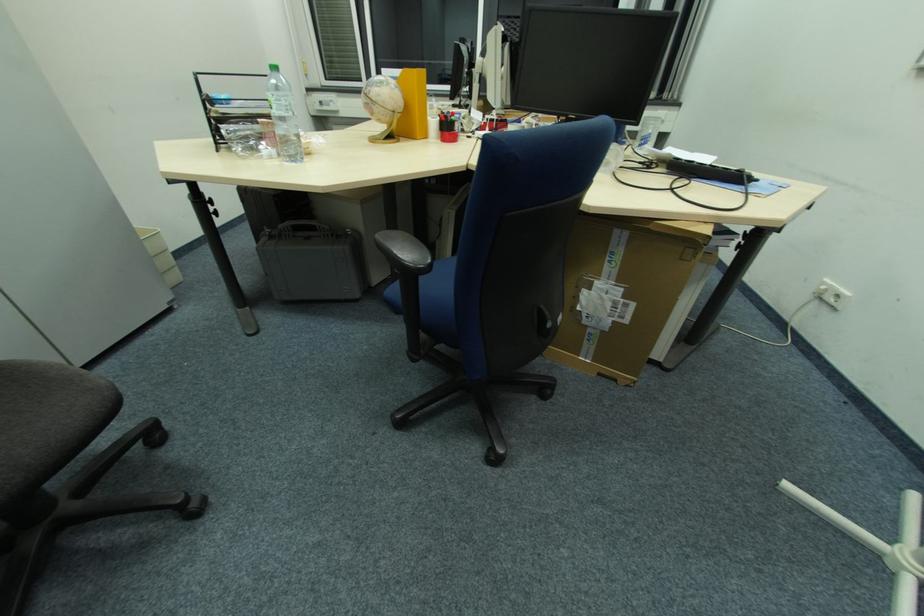
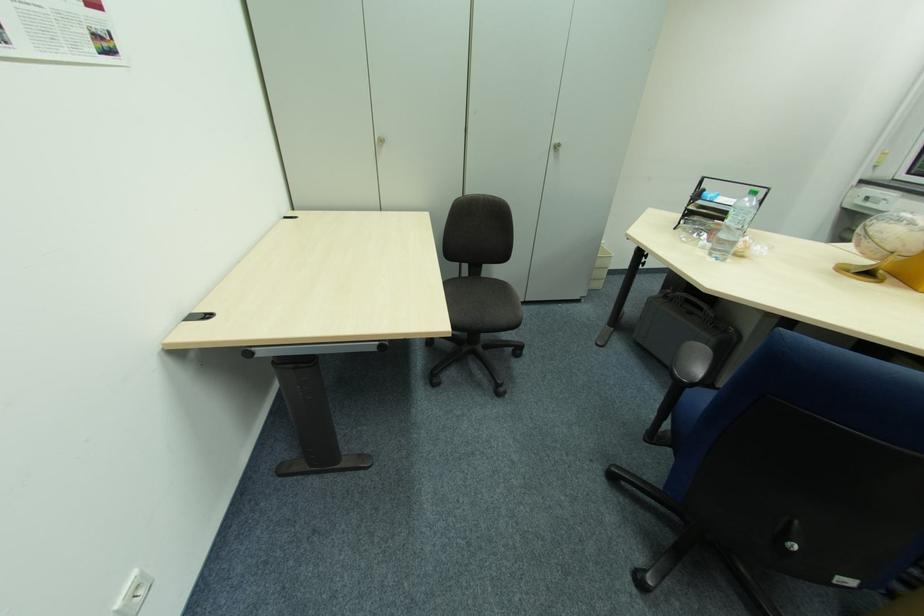
In the second image, find the point that corresponds to point (289, 111) in the first image.

(743, 224)